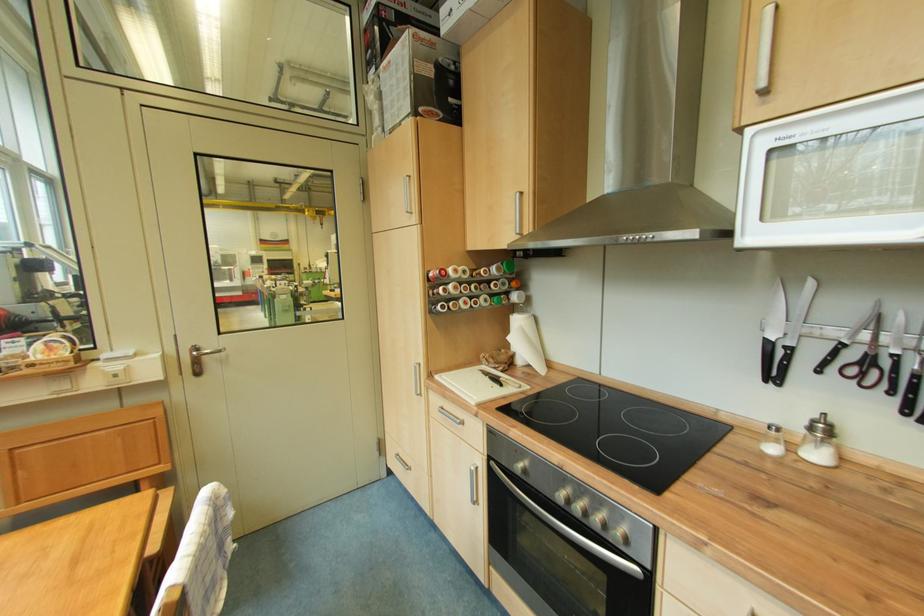
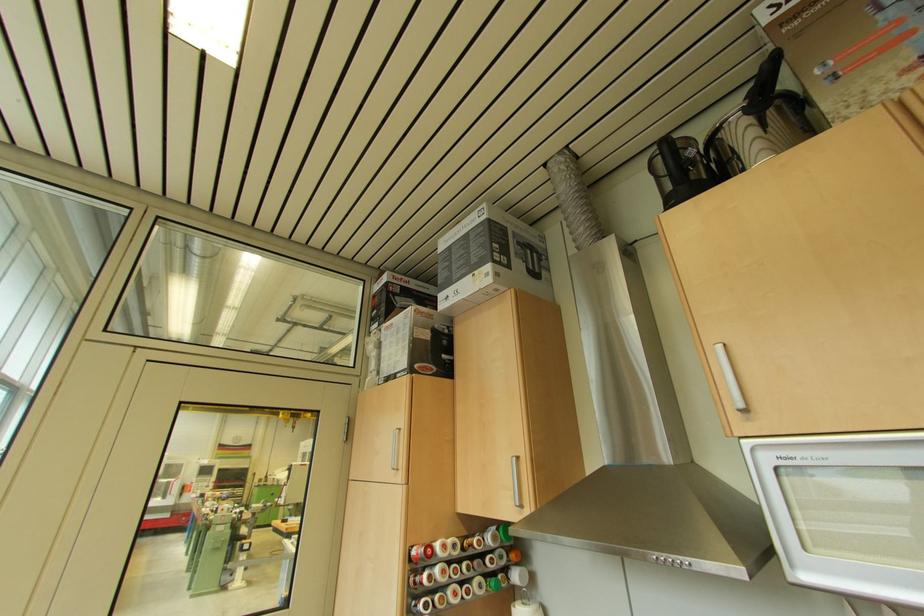
The point at (287, 286) is marked in the first image. Where is the corresponding point in the second image?

(229, 513)